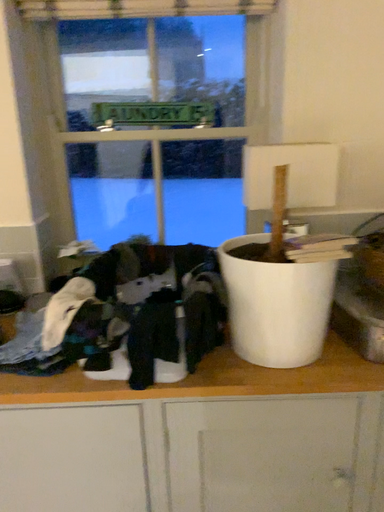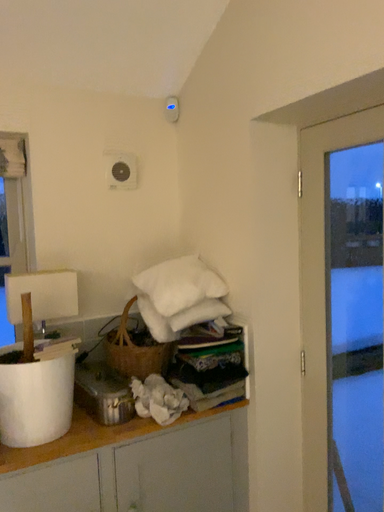
Question: How did the camera likely rotate when shooting the video?

Choices:
 (A) rotated downward
 (B) rotated upward

Answer: (B)